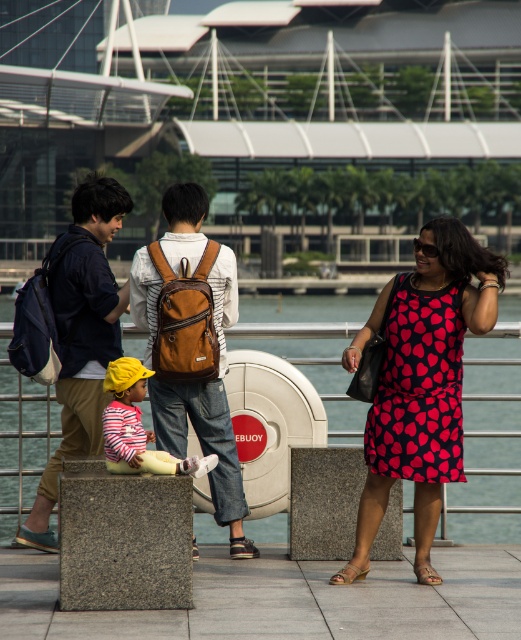
Does clear blue water at center have a larger size compared to brown leather backpack at center?

Yes, clear blue water at center is bigger than brown leather backpack at center.

Who is lower down, clear blue water at center or brown leather backpack at center?

brown leather backpack at center is lower down.

Locate an element on the screen. Image resolution: width=521 pixels, height=640 pixels. clear blue water at center is located at coordinates (305, 307).

Measure the distance between clear blue water at center and camera.

clear blue water at center and camera are 11.17 meters apart.

What do you see at coordinates (305, 307) in the screenshot? I see `clear blue water at center` at bounding box center [305, 307].

Which is behind, point (510, 348) or point (92, 349)?

Point (510, 348)

Where is `clear blue water at center`? The height and width of the screenshot is (640, 521). clear blue water at center is located at coordinates (305, 307).

Which is above, brown leather backpack at center or dark red printed dress at center?

dark red printed dress at center is higher up.

Is point (177, 340) closer to camera compared to point (406, 410)?

That is False.

Who is more forward, (x=167, y=323) or (x=445, y=364)?

Positioned in front is point (x=445, y=364).

This screenshot has height=640, width=521. What are the coordinates of `brown leather backpack at center` in the screenshot? It's located at (192, 346).